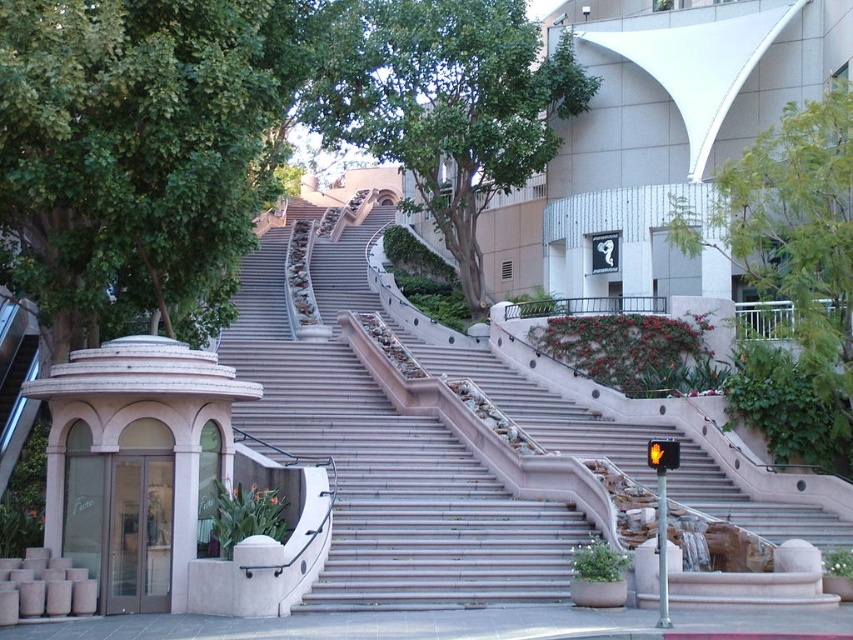
You are standing at the base of the grand staircase and want to take a photo. There are two points marked in the scene, point 1 at coordinates point (456, 260) and point 2 at coordinates point (838, 109). Which point will appear closer to you in the photo?

Point 1 at coordinates point (456, 260) will appear closer to you in the photo because it is further to the camera than point 2 at coordinates point (838, 109).

You are standing at the base of the grand staircase and want to reach the small pinkish structure on the left. There is a green leafy tree at left blocking your path. Can you walk around it to get to the structure?

The green leafy tree at left is 124.11 feet away from you, so you can easily walk around it to reach the small pinkish structure on the left.

You are standing at the bottom of the grand staircase and want to walk towards the green leafy tree at center. Which direction should you walk to avoid the green leafy tree at upper center?

You should walk towards the green leafy tree at center directly since it is closer to you than the green leafy tree at upper center, so you won not encounter the upper one if you head straight towards the closer one.